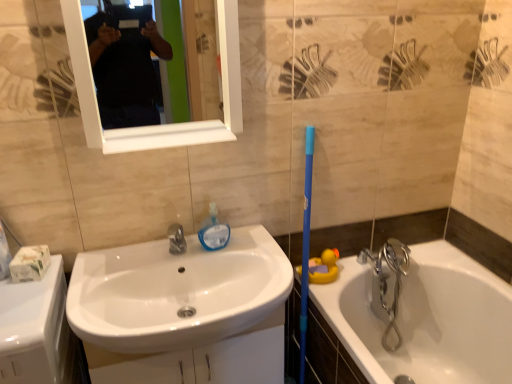
Question: Is yellow rubber duck at lower right turned away from white glossy mirror at upper center?

Choices:
 (A) no
 (B) yes

Answer: (A)

Question: From a real-world perspective, is yellow rubber duck at lower right located higher than white glossy mirror at upper center?

Choices:
 (A) yes
 (B) no

Answer: (B)

Question: Is yellow rubber duck at lower right to the left of white glossy mirror at upper center from the viewer's perspective?

Choices:
 (A) yes
 (B) no

Answer: (B)

Question: From a real-world perspective, is yellow rubber duck at lower right below white glossy mirror at upper center?

Choices:
 (A) yes
 (B) no

Answer: (A)

Question: Does yellow rubber duck at lower right have a larger size compared to white glossy mirror at upper center?

Choices:
 (A) yes
 (B) no

Answer: (B)

Question: Is yellow rubber duck at lower right oriented towards white glossy mirror at upper center?

Choices:
 (A) no
 (B) yes

Answer: (A)

Question: Is chrome metallic faucet at right at the right side of white glossy sink at center?

Choices:
 (A) no
 (B) yes

Answer: (B)

Question: Is chrome metallic faucet at right in front of white glossy sink at center?

Choices:
 (A) no
 (B) yes

Answer: (A)

Question: From a real-world perspective, is chrome metallic faucet at right located beneath white glossy sink at center?

Choices:
 (A) no
 (B) yes

Answer: (B)

Question: From a real-world perspective, is chrome metallic faucet at right on top of white glossy sink at center?

Choices:
 (A) yes
 (B) no

Answer: (B)

Question: Is chrome metallic faucet at right smaller than white glossy sink at center?

Choices:
 (A) yes
 (B) no

Answer: (A)

Question: Is chrome metallic faucet at right not within white glossy sink at center?

Choices:
 (A) no
 (B) yes

Answer: (B)

Question: Is translucent plastic soap dispenser at center not near white glossy counter top at lower left?

Choices:
 (A) no
 (B) yes

Answer: (A)